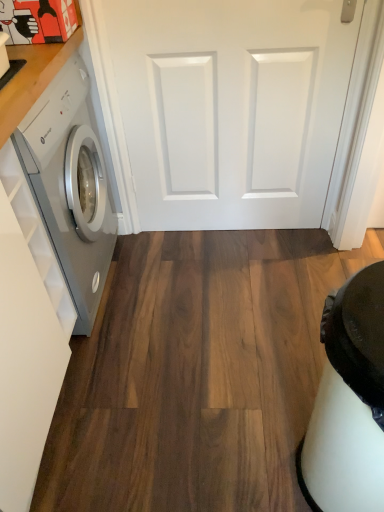
Question: From the image's perspective, does satin white washing machine at left appear lower than white matte door at center?

Choices:
 (A) no
 (B) yes

Answer: (B)

Question: Is satin white washing machine at left shorter than white matte door at center?

Choices:
 (A) no
 (B) yes

Answer: (A)

Question: Can you see satin white washing machine at left touching white matte door at center?

Choices:
 (A) yes
 (B) no

Answer: (B)

Question: Is satin white washing machine at left behind white matte door at center?

Choices:
 (A) no
 (B) yes

Answer: (A)

Question: Is white matte door at center a part of satin white washing machine at left?

Choices:
 (A) yes
 (B) no

Answer: (B)

Question: Does satin white washing machine at left appear on the right side of white matte door at center?

Choices:
 (A) yes
 (B) no

Answer: (B)

Question: Is satin white washing machine at left inside white matte door at center?

Choices:
 (A) yes
 (B) no

Answer: (B)

Question: Is white matte door at center far away from satin white washing machine at left?

Choices:
 (A) yes
 (B) no

Answer: (B)

Question: Does white matte door at center have a greater height compared to satin white washing machine at left?

Choices:
 (A) no
 (B) yes

Answer: (A)

Question: Considering the relative sizes of white matte door at center and satin white washing machine at left in the image provided, is white matte door at center shorter than satin white washing machine at left?

Choices:
 (A) yes
 (B) no

Answer: (A)

Question: From the image's perspective, does white matte door at center appear lower than satin white washing machine at left?

Choices:
 (A) yes
 (B) no

Answer: (B)

Question: Is white matte door at center wider than satin white washing machine at left?

Choices:
 (A) yes
 (B) no

Answer: (B)

Question: Is point (264, 79) closer or farther from the camera than point (77, 177)?

Choices:
 (A) closer
 (B) farther

Answer: (B)